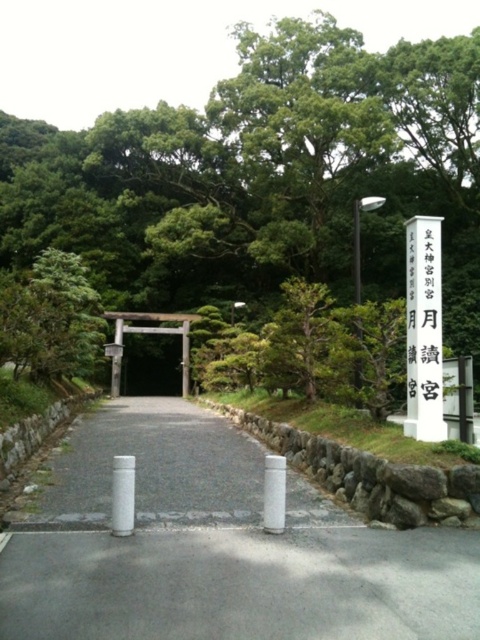
Is point (106, 456) in front of point (183, 371)?

Yes, point (106, 456) is in front of point (183, 371).

Is gray asphalt path at center taller than wooden torii gate at center?

No.

What do you see at coordinates (151, 468) in the screenshot? The image size is (480, 640). I see `gray asphalt path at center` at bounding box center [151, 468].

Where is `gray asphalt path at center`? Image resolution: width=480 pixels, height=640 pixels. gray asphalt path at center is located at coordinates (151, 468).

Which is in front, point (140, 276) or point (186, 380)?

Point (186, 380) is more forward.

Between green leafy tree at center and wooden torii gate at center, which one has more height?

green leafy tree at center is taller.

At what (x,y) coordinates should I click in order to perform the action: click on green leafy tree at center. Please return your answer as a coordinate pair (x, y). Image resolution: width=480 pixels, height=640 pixels. Looking at the image, I should click on tap(264, 177).

Can you confirm if black stone sign at right is smaller than white smooth pillar at center?

Actually, black stone sign at right might be larger than white smooth pillar at center.

Is black stone sign at right shorter than white smooth pillar at center?

No.

Where is `black stone sign at right`? This screenshot has height=640, width=480. black stone sign at right is located at coordinates (423, 314).